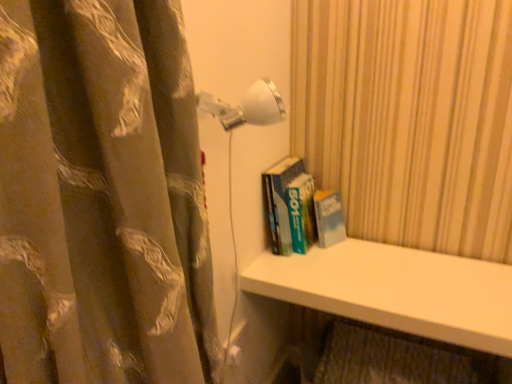
You are a GUI agent. You are given a task and a screenshot of the screen. Output one action in this format:
    pyautogui.click(x=<x>, y=<y>)
    Task: Click on the free space above white smooth shelf at lower center (from a real-world perspective)
    
    Given the screenshot: What is the action you would take?
    pyautogui.click(x=422, y=281)